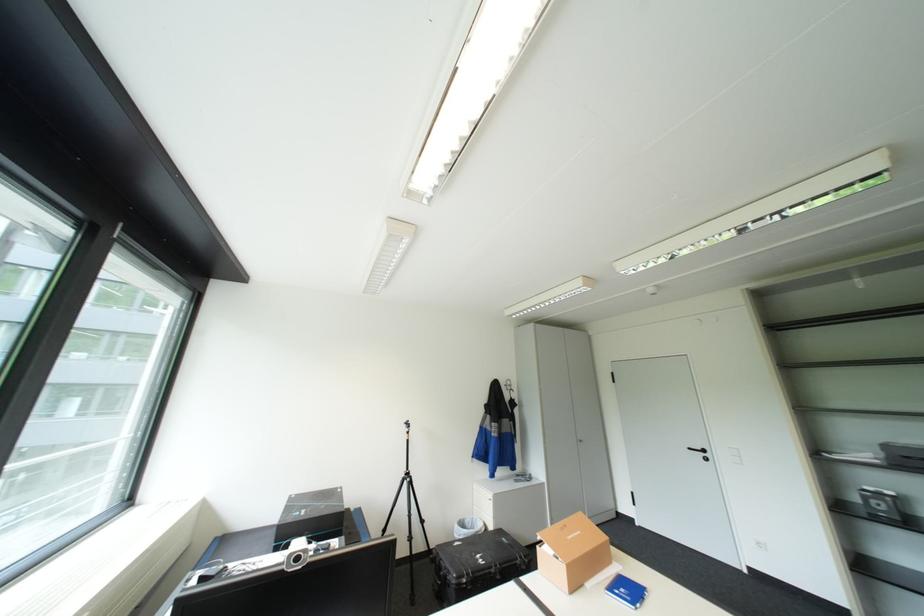
Find the location of a particular element. The width and height of the screenshot is (924, 616). blue notebook is located at coordinates (626, 591).